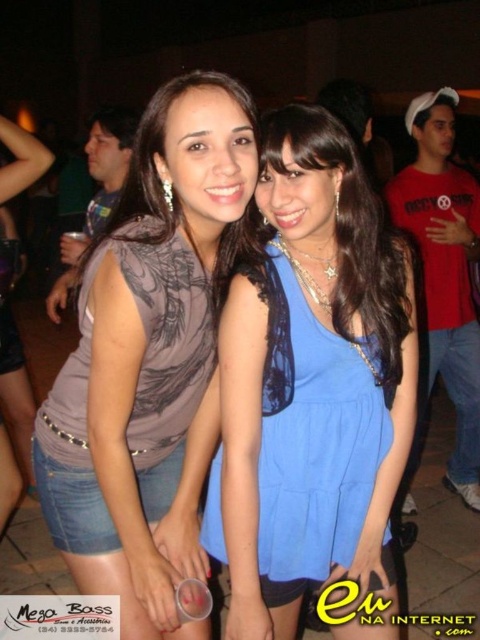
Is point (171, 460) positioned after point (376, 385)?

Yes, it is.

What are the coordinates of `matte gray shirt at center` in the screenshot? It's located at (149, 356).

This screenshot has width=480, height=640. What do you see at coordinates (149, 356) in the screenshot?
I see `matte gray shirt at center` at bounding box center [149, 356].

The image size is (480, 640). I want to click on matte gray shirt at center, so click(149, 356).

Which is above, matte gray tank top at center or blue lace dress at center?

matte gray tank top at center is higher up.

The width and height of the screenshot is (480, 640). I want to click on matte gray tank top at center, so click(134, 394).

Which is in front, point (149, 456) or point (210, 481)?

Positioned in front is point (210, 481).

Find the location of a particular element. matte gray tank top at center is located at coordinates (134, 394).

From the picture: Is matte gray shirt at center closer to camera compared to matte gray tank top at center?

That is True.

Who is higher up, matte gray shirt at center or matte gray tank top at center?

matte gray shirt at center

Is point (117, 369) closer to camera compared to point (168, 477)?

That is True.

Identify the location of matte gray shirt at center. (149, 356).